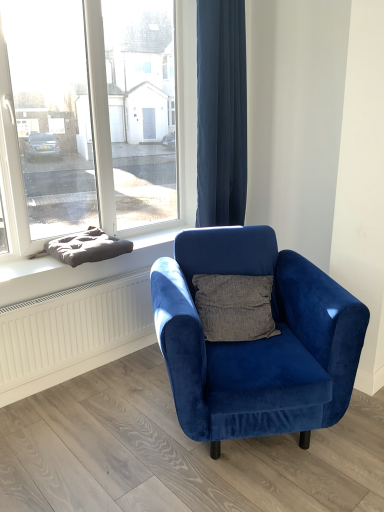
You are a GUI agent. You are given a task and a screenshot of the screen. Output one action in this format:
    pyautogui.click(x=<x>, y=<y>)
    Task: Click on the free space in front of white textured radiator at lower left
    Image resolution: width=384 pixels, height=512 pixels.
    Given the screenshot: What is the action you would take?
    pyautogui.click(x=74, y=415)